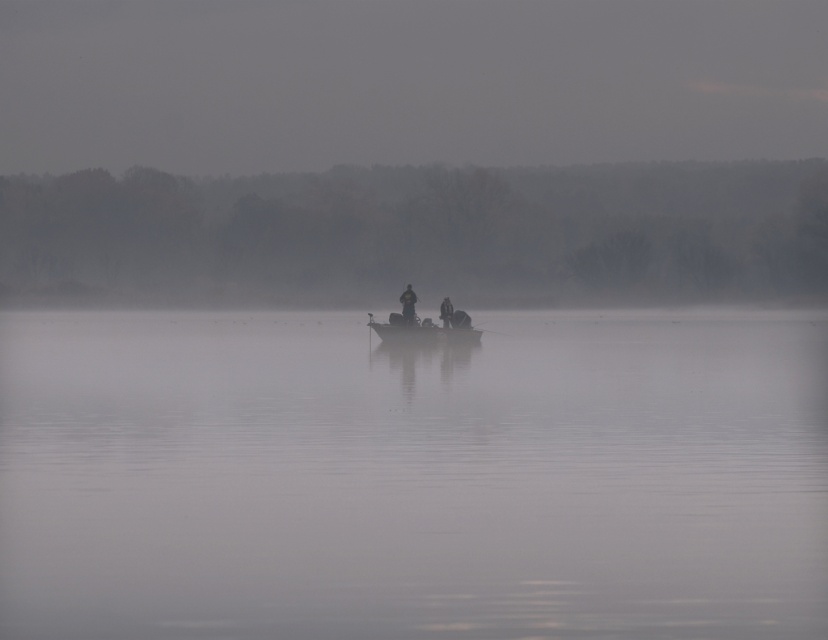
Does dark blue jacket at center lie in front of dark gray jacket at center?

Yes, dark blue jacket at center is closer to the viewer.

The height and width of the screenshot is (640, 828). Identify the location of dark blue jacket at center. (408, 305).

Between point (456, 176) and point (412, 296), which one is positioned in front?

Point (412, 296) is in front.

Does foggy misty atmosphere at center have a greater width compared to dark blue jacket at center?

Yes.

Which is behind, point (744, 179) or point (414, 298)?

The point (744, 179) is more distant.

The width and height of the screenshot is (828, 640). Find the location of `foggy misty atmosphere at center`. foggy misty atmosphere at center is located at coordinates (421, 234).

Who is more forward, (514,577) or (400,296)?

Point (514,577)

Is point (258, 589) behind point (408, 289)?

No.

You are a GUI agent. You are given a task and a screenshot of the screen. Output one action in this format:
    pyautogui.click(x=<x>, y=<y>)
    Task: Click on the transparent misty water at center
    The image size is (828, 640).
    Given the screenshot: What is the action you would take?
    pyautogui.click(x=412, y=476)